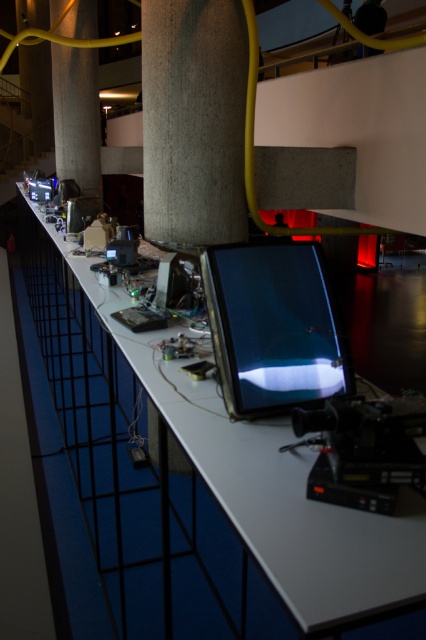
Question: Is the position of shiny black tablet at center less distant than that of concrete column at center?

Choices:
 (A) yes
 (B) no

Answer: (A)

Question: Estimate the real-world distances between objects in this image. Which object is closer to the concrete column at center?

Choices:
 (A) metallic silver table at center
 (B) shiny black tablet at center
 (C) concrete textured pillar at center

Answer: (C)

Question: Which object appears farthest from the camera in this image?

Choices:
 (A) concrete textured pillar at center
 (B) concrete column at center
 (C) metallic silver table at center
 (D) shiny black tablet at center

Answer: (B)

Question: Can you confirm if concrete textured pillar at center is positioned to the left of concrete column at center?

Choices:
 (A) yes
 (B) no

Answer: (B)

Question: Does metallic silver table at center have a greater width compared to concrete textured pillar at center?

Choices:
 (A) no
 (B) yes

Answer: (A)

Question: Estimate the real-world distances between objects in this image. Which object is closer to the shiny black tablet at center?

Choices:
 (A) metallic silver table at center
 (B) concrete textured pillar at center

Answer: (A)